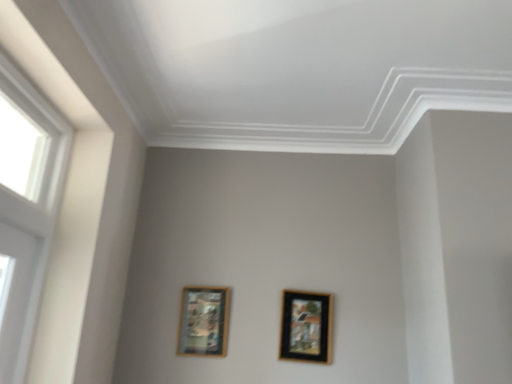
Where is `black glossy picture frame at center, which appears as the second picture frame when viewed from the left`? The image size is (512, 384). black glossy picture frame at center, which appears as the second picture frame when viewed from the left is located at coordinates (306, 326).

You are a GUI agent. You are given a task and a screenshot of the screen. Output one action in this format:
    pyautogui.click(x=<x>, y=<y>)
    Task: Click on the black glossy picture frame at center, marked as the 1th picture frame in a right-to-left arrangement
    The width and height of the screenshot is (512, 384).
    Given the screenshot: What is the action you would take?
    pyautogui.click(x=306, y=326)

Is black glossy picture frame at center, which appears as the second picture frame when viewed from the left, taller or shorter than white plastic window at left?

black glossy picture frame at center, which appears as the second picture frame when viewed from the left, is shorter than white plastic window at left.

Does black glossy picture frame at center, marked as the 1th picture frame in a right-to-left arrangement, contain white plastic window at left?

No, white plastic window at left is not inside black glossy picture frame at center, marked as the 1th picture frame in a right-to-left arrangement.

Based on the photo, from the image's perspective, relative to white plastic window at left, is black glossy picture frame at center, which appears as the second picture frame when viewed from the left, above or below?

From the image's perspective, black glossy picture frame at center, which appears as the second picture frame when viewed from the left, appears below white plastic window at left.

Does point (12, 319) lie behind point (207, 326)?

No, (12, 319) is closer to viewer.

From a real-world perspective, is white plastic window at left physically located above or below wooden framed artwork at lower left, which is counted as the 1th picture frame, starting from the left?

Clearly, from a real-world perspective, white plastic window at left is above wooden framed artwork at lower left, which is counted as the 1th picture frame, starting from the left.

Is white plastic window at left beside wooden framed artwork at lower left, positioned as the 2th picture frame in right-to-left order?

No, white plastic window at left is not making contact with wooden framed artwork at lower left, positioned as the 2th picture frame in right-to-left order.

Looking at this image, is the depth of white plastic window at left greater than that of wooden framed artwork at lower left, positioned as the 2th picture frame in right-to-left order?

No, white plastic window at left is closer to the viewer.

From the image's perspective, does wooden framed artwork at lower left, positioned as the 2th picture frame in right-to-left order, appear higher than white plastic window at left?

No, from the image's perspective, wooden framed artwork at lower left, positioned as the 2th picture frame in right-to-left order, is not above white plastic window at left.

Considering the positions of objects wooden framed artwork at lower left, which is counted as the 1th picture frame, starting from the left, and white plastic window at left in the image provided, who is more to the right, wooden framed artwork at lower left, which is counted as the 1th picture frame, starting from the left, or white plastic window at left?

From the viewer's perspective, wooden framed artwork at lower left, which is counted as the 1th picture frame, starting from the left, appears more on the right side.

Based on the photo, which object is further away from the camera taking this photo, wooden framed artwork at lower left, which is counted as the 1th picture frame, starting from the left, or white plastic window at left?

wooden framed artwork at lower left, which is counted as the 1th picture frame, starting from the left, is more distant.

Is point (228, 292) farther from camera compared to point (54, 160)?

Yes, it is behind point (54, 160).

Does black glossy picture frame at center, which appears as the second picture frame when viewed from the left, have a smaller size compared to wooden framed artwork at lower left, which is counted as the 1th picture frame, starting from the left?

No, black glossy picture frame at center, which appears as the second picture frame when viewed from the left, is not smaller than wooden framed artwork at lower left, which is counted as the 1th picture frame, starting from the left.

Image resolution: width=512 pixels, height=384 pixels. Identify the location of picture frame directly beneath the black glossy picture frame at center, which appears as the second picture frame when viewed from the left (from a real-world perspective). (203, 321).

Can you tell me how much black glossy picture frame at center, which appears as the second picture frame when viewed from the left, and wooden framed artwork at lower left, positioned as the 2th picture frame in right-to-left order, differ in facing direction?

0.759 degrees separate the facing orientations of black glossy picture frame at center, which appears as the second picture frame when viewed from the left, and wooden framed artwork at lower left, positioned as the 2th picture frame in right-to-left order.

Could wooden framed artwork at lower left, which is counted as the 1th picture frame, starting from the left, be considered to be inside black glossy picture frame at center, which appears as the second picture frame when viewed from the left?

Actually, wooden framed artwork at lower left, which is counted as the 1th picture frame, starting from the left, is outside black glossy picture frame at center, which appears as the second picture frame when viewed from the left.

Who is more distant, white plastic window at left or black glossy picture frame at center, which appears as the second picture frame when viewed from the left?

Positioned behind is black glossy picture frame at center, which appears as the second picture frame when viewed from the left.

Identify the location of window lying above the black glossy picture frame at center, marked as the 1th picture frame in a right-to-left arrangement (from the image's perspective). The image size is (512, 384). (25, 208).

Measure the distance between white plastic window at left and black glossy picture frame at center, marked as the 1th picture frame in a right-to-left arrangement.

white plastic window at left and black glossy picture frame at center, marked as the 1th picture frame in a right-to-left arrangement, are 1.17 meters apart from each other.

Which is in front, point (6, 306) or point (323, 325)?

The point (6, 306) is in front.

Is wooden framed artwork at lower left, positioned as the 2th picture frame in right-to-left order, looking in the opposite direction of black glossy picture frame at center, marked as the 1th picture frame in a right-to-left arrangement?

No.

Is wooden framed artwork at lower left, positioned as the 2th picture frame in right-to-left order, positioned far away from black glossy picture frame at center, which appears as the second picture frame when viewed from the left?

They are positioned close to each other.

Consider the image. Considering the sizes of objects wooden framed artwork at lower left, positioned as the 2th picture frame in right-to-left order, and black glossy picture frame at center, marked as the 1th picture frame in a right-to-left arrangement, in the image provided, who is bigger, wooden framed artwork at lower left, positioned as the 2th picture frame in right-to-left order, or black glossy picture frame at center, marked as the 1th picture frame in a right-to-left arrangement,?

black glossy picture frame at center, marked as the 1th picture frame in a right-to-left arrangement.

How many degrees apart are the facing directions of wooden framed artwork at lower left, positioned as the 2th picture frame in right-to-left order, and black glossy picture frame at center, marked as the 1th picture frame in a right-to-left arrangement?

There is a 0.759-degree angle between the facing directions of wooden framed artwork at lower left, positioned as the 2th picture frame in right-to-left order, and black glossy picture frame at center, marked as the 1th picture frame in a right-to-left arrangement.

Find the location of `the 2nd picture frame counting from the right side of the white plastic window at left`. the 2nd picture frame counting from the right side of the white plastic window at left is located at coordinates point(306,326).

At what (x,y) coordinates should I click in order to perform the action: click on window on the left side of wooden framed artwork at lower left, which is counted as the 1th picture frame, starting from the left. Please return your answer as a coordinate pair (x, y). Image resolution: width=512 pixels, height=384 pixels. Looking at the image, I should click on (25, 208).

Considering their positions, is black glossy picture frame at center, marked as the 1th picture frame in a right-to-left arrangement, positioned closer to white plastic window at left than wooden framed artwork at lower left, positioned as the 2th picture frame in right-to-left order?

wooden framed artwork at lower left, positioned as the 2th picture frame in right-to-left order, is positioned closer to the anchor white plastic window at left.

When comparing their distances from wooden framed artwork at lower left, positioned as the 2th picture frame in right-to-left order, does white plastic window at left or black glossy picture frame at center, marked as the 1th picture frame in a right-to-left arrangement, seem closer?

Based on the image, black glossy picture frame at center, marked as the 1th picture frame in a right-to-left arrangement, appears to be nearer to wooden framed artwork at lower left, positioned as the 2th picture frame in right-to-left order.

From the image, which object appears to be farther from wooden framed artwork at lower left, positioned as the 2th picture frame in right-to-left order, black glossy picture frame at center, marked as the 1th picture frame in a right-to-left arrangement, or white plastic window at left?

The object further to wooden framed artwork at lower left, positioned as the 2th picture frame in right-to-left order, is white plastic window at left.

From the image, which object appears to be nearer to white plastic window at left, wooden framed artwork at lower left, positioned as the 2th picture frame in right-to-left order, or black glossy picture frame at center, marked as the 1th picture frame in a right-to-left arrangement?

wooden framed artwork at lower left, positioned as the 2th picture frame in right-to-left order, is positioned closer to the anchor white plastic window at left.

When comparing their distances from black glossy picture frame at center, marked as the 1th picture frame in a right-to-left arrangement, does white plastic window at left or wooden framed artwork at lower left, positioned as the 2th picture frame in right-to-left order, seem further?

The object further to black glossy picture frame at center, marked as the 1th picture frame in a right-to-left arrangement, is white plastic window at left.

Looking at this image, estimate the real-world distances between objects in this image. Which object is closer to black glossy picture frame at center, marked as the 1th picture frame in a right-to-left arrangement, wooden framed artwork at lower left, positioned as the 2th picture frame in right-to-left order, or white plastic window at left?

wooden framed artwork at lower left, positioned as the 2th picture frame in right-to-left order, is positioned closer to the anchor black glossy picture frame at center, marked as the 1th picture frame in a right-to-left arrangement.

Where is `picture frame between white plastic window at left and wooden framed artwork at lower left, positioned as the 2th picture frame in right-to-left order, in the front-back direction`? The image size is (512, 384). picture frame between white plastic window at left and wooden framed artwork at lower left, positioned as the 2th picture frame in right-to-left order, in the front-back direction is located at coordinates (306, 326).